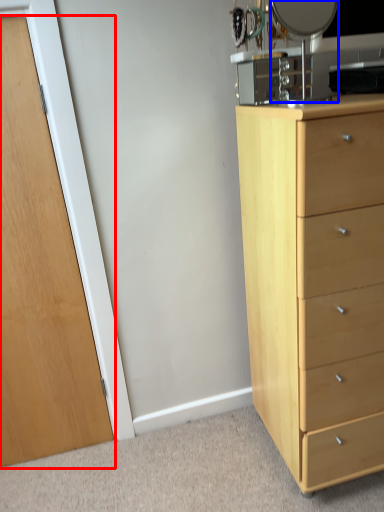
Question: Which object is further to the camera taking this photo, door (highlighted by a red box) or mirror (highlighted by a blue box)?

Choices:
 (A) door
 (B) mirror

Answer: (A)